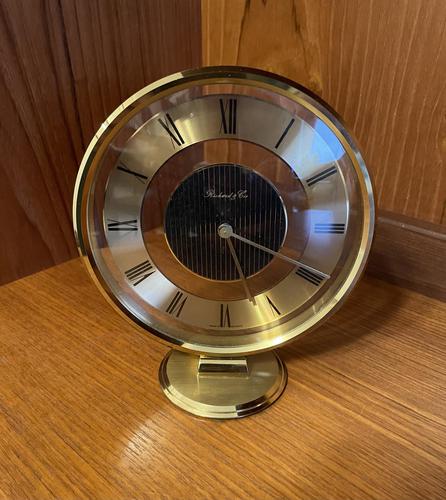
Please find what the clock is sitting on in the image and show me where they are. Your answer should be formatted as a list of tuples, i.e. [(x1, y1), (x2, y2), ...], where each tuple contains the x and y coordinates of a point satisfying the conditions above.

[(99, 416)]